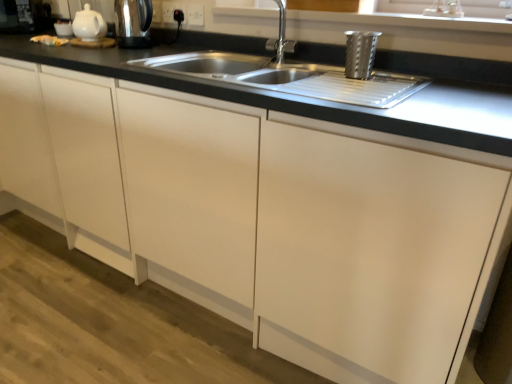
Question: From the image's perspective, is black plastic socket at upper center, marked as the first electric outlet in a left-to-right arrangement, on top of satin nickel faucet at upper center?

Choices:
 (A) yes
 (B) no

Answer: (A)

Question: Does black plastic socket at upper center, marked as the 2th electric outlet in a right-to-left arrangement, have a lesser height compared to satin nickel faucet at upper center?

Choices:
 (A) yes
 (B) no

Answer: (A)

Question: From a real-world perspective, is black plastic socket at upper center, marked as the 2th electric outlet in a right-to-left arrangement, positioned over satin nickel faucet at upper center based on gravity?

Choices:
 (A) no
 (B) yes

Answer: (B)

Question: From the image's perspective, is black plastic socket at upper center, marked as the 2th electric outlet in a right-to-left arrangement, under satin nickel faucet at upper center?

Choices:
 (A) yes
 (B) no

Answer: (B)

Question: Is black plastic socket at upper center, marked as the first electric outlet in a left-to-right arrangement, closer to the viewer compared to satin nickel faucet at upper center?

Choices:
 (A) no
 (B) yes

Answer: (A)

Question: Is black plastic socket at upper center, marked as the 2th electric outlet in a right-to-left arrangement, next to satin nickel faucet at upper center?

Choices:
 (A) yes
 (B) no

Answer: (B)

Question: Does satin nickel faucet at upper center have a greater width compared to white glossy teapot at upper left?

Choices:
 (A) yes
 (B) no

Answer: (B)

Question: From the image's perspective, is satin nickel faucet at upper center above white glossy teapot at upper left?

Choices:
 (A) yes
 (B) no

Answer: (B)

Question: From a real-world perspective, is satin nickel faucet at upper center on white glossy teapot at upper left?

Choices:
 (A) no
 (B) yes

Answer: (B)

Question: Does satin nickel faucet at upper center appear on the right side of white glossy teapot at upper left?

Choices:
 (A) no
 (B) yes

Answer: (B)

Question: Can you confirm if satin nickel faucet at upper center is bigger than white glossy teapot at upper left?

Choices:
 (A) no
 (B) yes

Answer: (A)

Question: Is white glossy teapot at upper left at the back of satin nickel faucet at upper center?

Choices:
 (A) no
 (B) yes

Answer: (A)

Question: From the image's perspective, does metallic stainless steel kettle at upper left, the second appliance in the bottom-to-top sequence, appear lower than black plastic socket at upper center, marked as the 2th electric outlet in a right-to-left arrangement?

Choices:
 (A) no
 (B) yes

Answer: (B)